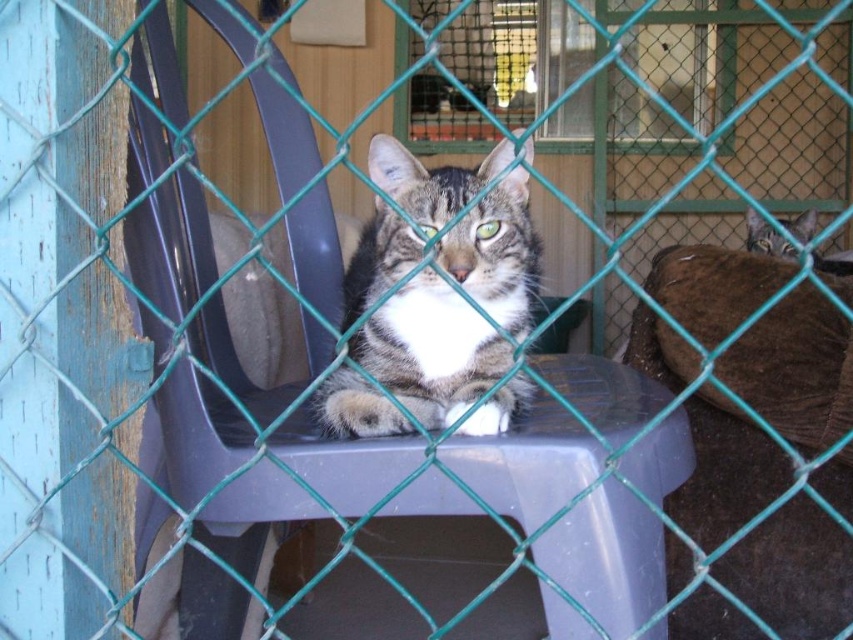
Is the position of tabby fur cat at center more distant than that of tabby fur cat at upper right?

That is False.

Is point (410, 259) less distant than point (780, 244)?

Yes.

In order to click on tabby fur cat at center in this screenshot , I will do `click(430, 349)`.